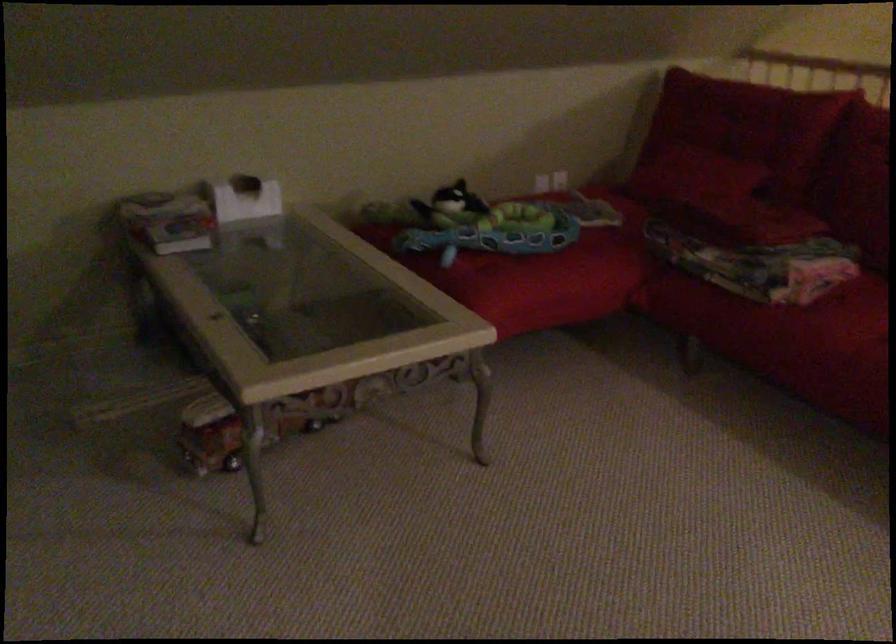
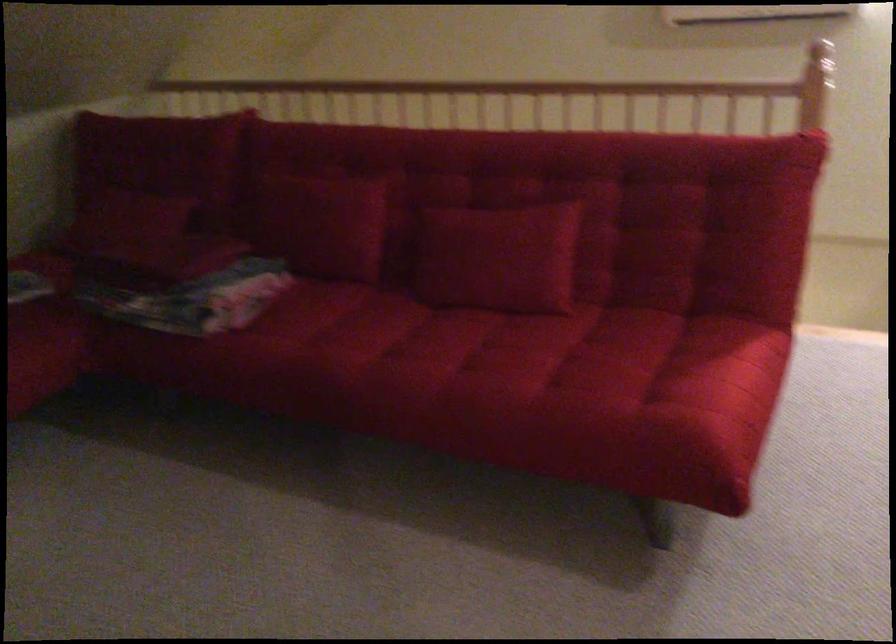
Question: How did the camera likely rotate?

Choices:
 (A) Left
 (B) Right
 (C) Up
 (D) Down

Answer: (B)